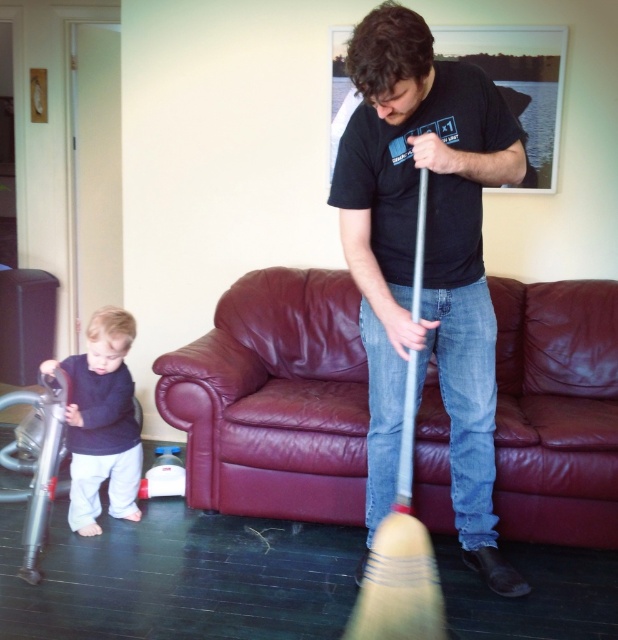
Question: Among these points, which one is farthest from the camera?

Choices:
 (A) (387, 387)
 (B) (91, 321)

Answer: (B)

Question: Which of the following is the farthest from the observer?

Choices:
 (A) black matte t-shirt at center
 (B) dark blue sweater at lower left

Answer: (B)

Question: In this image, where is black matte t-shirt at center located relative to dark blue sweater at lower left?

Choices:
 (A) above
 (B) below

Answer: (A)

Question: Is black matte t-shirt at center closer to camera compared to dark blue sweater at lower left?

Choices:
 (A) no
 (B) yes

Answer: (B)

Question: Does black matte t-shirt at center lie in front of dark blue sweater at lower left?

Choices:
 (A) yes
 (B) no

Answer: (A)